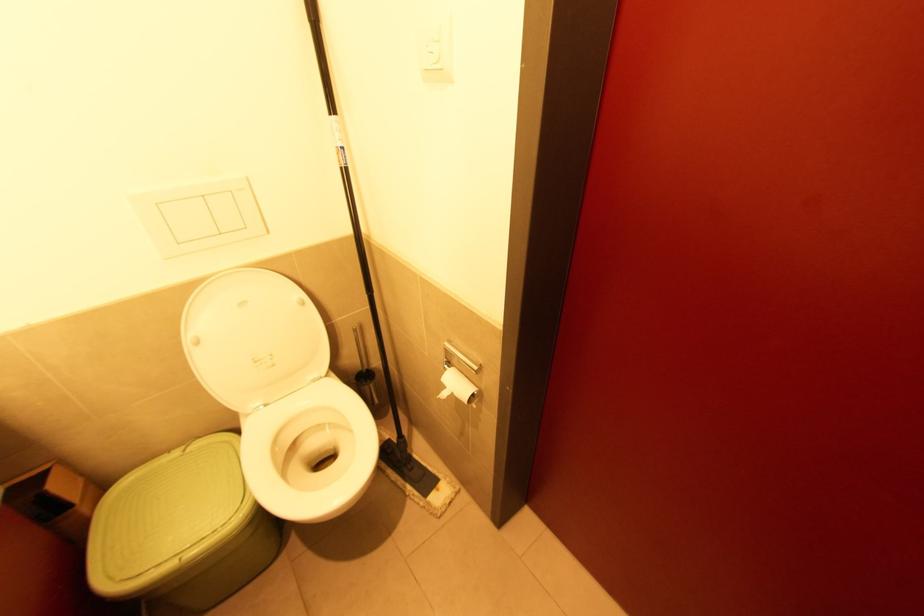
Identify the location of toilet brush handle. Image resolution: width=924 pixels, height=616 pixels. (365, 371).